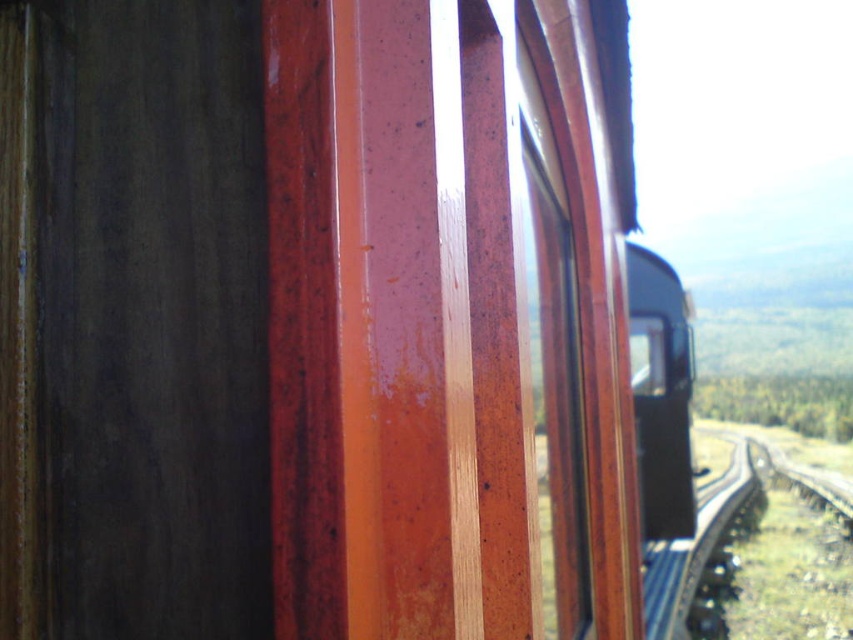
You are sitting inside the train and looking out. You notice the glossy wood window at upper right and the smooth asphalt train track at right. Which object is nearer to you?

The glossy wood window at upper right is closer to the viewer than the smooth asphalt train track at right.

Consider the image. You are a passenger sitting in the train and looking out. You notice the glossy wood window at upper right and the smooth asphalt train track at right. Which object appears bigger in the scene?

The glossy wood window at upper right appears bigger than the smooth asphalt train track at right because it is larger in size.

You are inside a train and want to look outside. The glossy wood window at upper right is your only option. Can you reach the point at coordinates (555, 326) on the window to press your face against it?

The point at coordinates (555, 326) corresponds to the glossy wood window at upper right, so yes, you can reach it to press your face against the window.